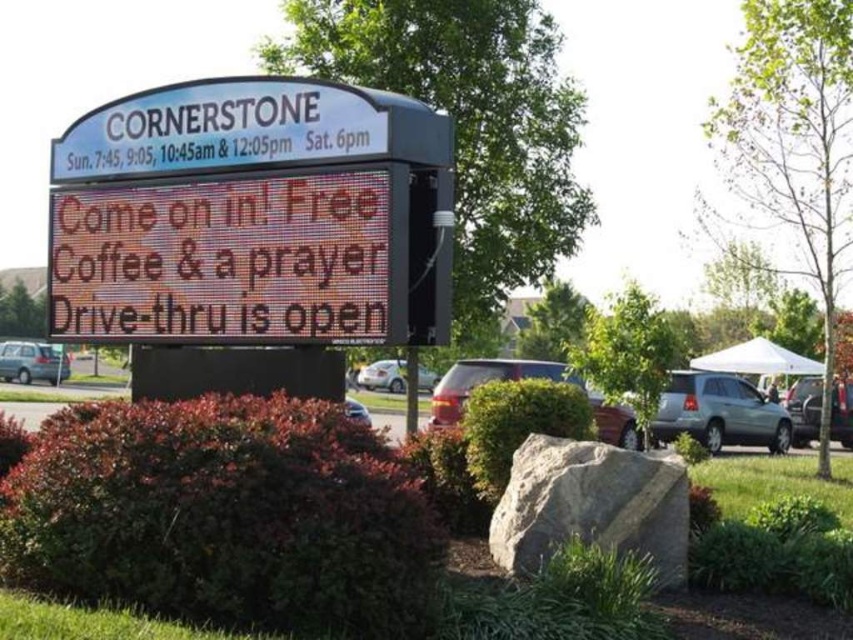
You are standing at the camera position and want to take a photo of the silver metallic suv at right. Is the suv within the camera frame?

The silver metallic suv at right is 59.93 feet away from the camera, so it is within the camera frame as most cameras can capture objects at that distance.

You are standing in front of the Cornerstone signboard and see the silver metallic suv at right. If you want to take a photo of the signboard without the suv in the frame, how far back should you move?

The silver metallic suv at right is 18.27 meters from the viewer. To exclude it from the photo, move back until the suv is out of the camera frame, ensuring the distance allows the signboard to be centered while excluding the suv.

You are a visitor arriving at Cornerstone and see the silver metallic suv at right and the matte red suv at center parked nearby. Which SUV is bigger in size?

The matte red suv at center is bigger in size compared to the silver metallic suv at right.